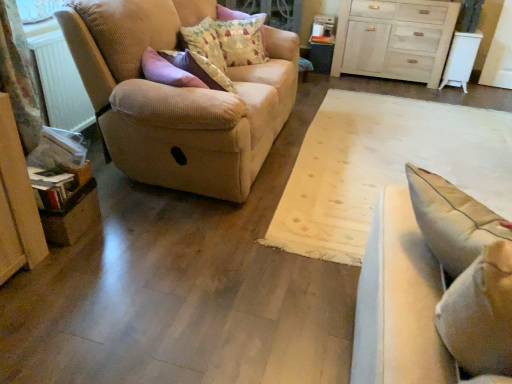
Question: Is fluffy cotton pillow at upper center, arranged as the 1th pillow when viewed from the front, looking in the opposite direction of beige corduroy couch at left, placed as the second studio couch when sorted from right to left?

Choices:
 (A) yes
 (B) no

Answer: (A)

Question: From the image's perspective, would you say fluffy cotton pillow at upper center, placed as the 2th pillow when sorted from back to front, is positioned over beige corduroy couch at left, which appears as the first studio couch when viewed from the left?

Choices:
 (A) no
 (B) yes

Answer: (B)

Question: Is the position of fluffy cotton pillow at upper center, placed as the 2th pillow when sorted from back to front, more distant than that of beige corduroy couch at left, which appears as the first studio couch when viewed from the left?

Choices:
 (A) yes
 (B) no

Answer: (A)

Question: Can you confirm if fluffy cotton pillow at upper center, arranged as the 1th pillow when viewed from the front, is smaller than beige corduroy couch at left, which is the second studio couch in front-to-back order?

Choices:
 (A) yes
 (B) no

Answer: (A)

Question: Is beige corduroy couch at left, which is the second studio couch in front-to-back order, surrounded by fluffy cotton pillow at upper center, arranged as the 1th pillow when viewed from the front?

Choices:
 (A) no
 (B) yes

Answer: (A)

Question: From their relative heights in the image, would you say light beige fabric studio couch at right, acting as the first studio couch starting from the front, is taller or shorter than patterned fabric pillow at upper center, which is the 2th pillow in front-to-back order?

Choices:
 (A) short
 (B) tall

Answer: (B)

Question: In the image, is light beige fabric studio couch at right, positioned as the 2th studio couch in back-to-front order, on the left side or the right side of patterned fabric pillow at upper center, which is the 2th pillow in front-to-back order?

Choices:
 (A) left
 (B) right

Answer: (B)

Question: Considering the positions of light beige fabric studio couch at right, which is counted as the first studio couch, starting from the right, and patterned fabric pillow at upper center, which is the 2th pillow in front-to-back order, in the image, is light beige fabric studio couch at right, which is counted as the first studio couch, starting from the right, wider or thinner than patterned fabric pillow at upper center, which is the 2th pillow in front-to-back order,?

Choices:
 (A) wide
 (B) thin

Answer: (A)

Question: Relative to patterned fabric pillow at upper center, which is the 2th pillow in front-to-back order, is light beige fabric studio couch at right, the second studio couch in the left-to-right sequence, in front or behind?

Choices:
 (A) behind
 (B) front

Answer: (B)

Question: From the image's perspective, is white plastic radiator at left located above or below fluffy cotton pillow at upper center, arranged as the 1th pillow when viewed from the front?

Choices:
 (A) below
 (B) above

Answer: (A)

Question: From their relative heights in the image, would you say white plastic radiator at left is taller or shorter than fluffy cotton pillow at upper center, arranged as the 1th pillow when viewed from the front?

Choices:
 (A) short
 (B) tall

Answer: (B)

Question: Is white plastic radiator at left wider or thinner than fluffy cotton pillow at upper center, arranged as the 1th pillow when viewed from the front?

Choices:
 (A) thin
 (B) wide

Answer: (A)

Question: Looking at the image, does white plastic radiator at left seem bigger or smaller compared to fluffy cotton pillow at upper center, arranged as the 1th pillow when viewed from the front?

Choices:
 (A) big
 (B) small

Answer: (B)

Question: Would you say beige corduroy couch at left, placed as the first studio couch when sorted from back to front, is to the left or to the right of white plastic radiator at left in the picture?

Choices:
 (A) right
 (B) left

Answer: (A)

Question: Looking at their shapes, would you say beige corduroy couch at left, placed as the second studio couch when sorted from right to left, is wider or thinner than white plastic radiator at left?

Choices:
 (A) wide
 (B) thin

Answer: (A)